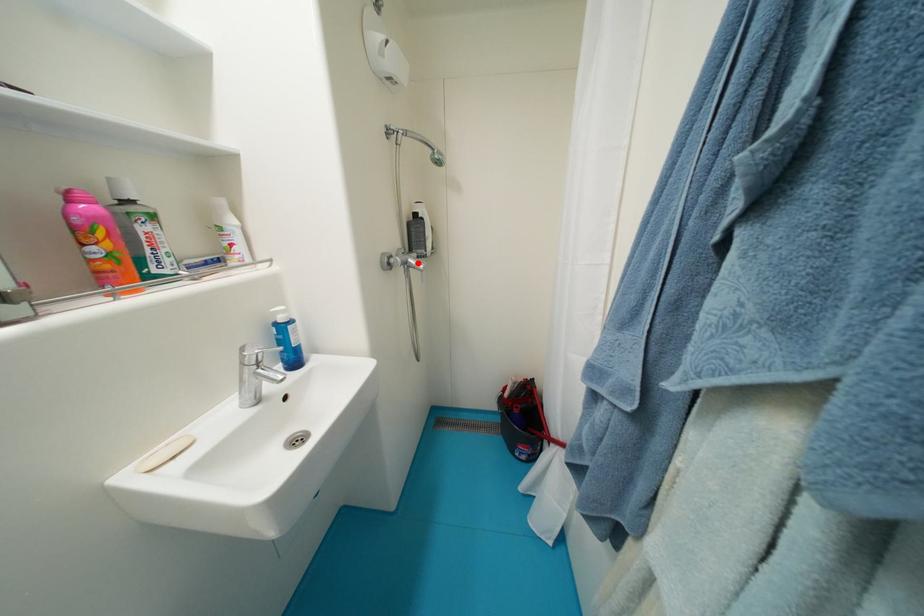
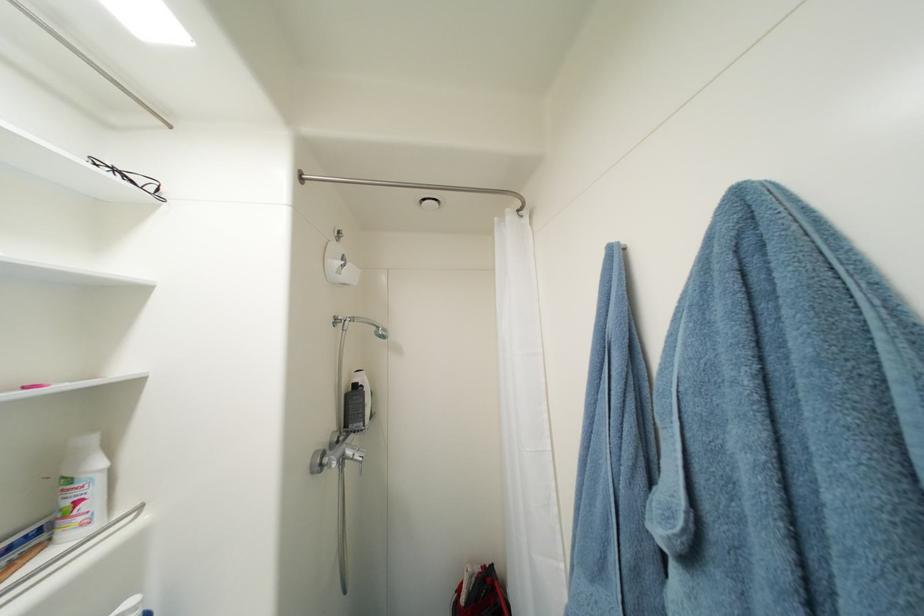
Where in the second image is the point corresponding to the highlighted location from the first image?

(356, 454)